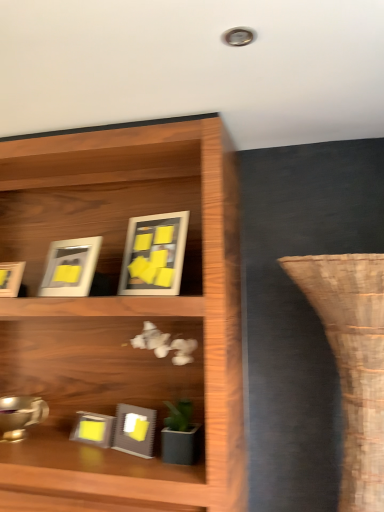
Question: Does matte gray picture frame at center, which appears as the 4th picture frame when viewed from the top, come in front of matte white picture frame at upper left, which ranks as the second picture frame in top-to-bottom order?

Choices:
 (A) yes
 (B) no

Answer: (A)

Question: From the image's perspective, is matte gray picture frame at center, arranged as the second picture frame when ordered from the bottom, located beneath matte white picture frame at upper left, positioned as the 4th picture frame in bottom-to-top order?

Choices:
 (A) no
 (B) yes

Answer: (B)

Question: Is matte gray picture frame at center, which appears as the 4th picture frame when viewed from the top, oriented towards matte white picture frame at upper left, positioned as the 4th picture frame in bottom-to-top order?

Choices:
 (A) no
 (B) yes

Answer: (A)

Question: Is matte gray picture frame at center, arranged as the second picture frame when ordered from the bottom, at the left side of matte white picture frame at upper left, positioned as the 4th picture frame in bottom-to-top order?

Choices:
 (A) yes
 (B) no

Answer: (B)

Question: Is matte gray picture frame at center, which appears as the 4th picture frame when viewed from the top, shorter than matte white picture frame at upper left, positioned as the 4th picture frame in bottom-to-top order?

Choices:
 (A) yes
 (B) no

Answer: (A)

Question: Based on their positions, is brown woven vase at right located to the left or right of matte white picture frame at upper left, positioned as the 4th picture frame in bottom-to-top order?

Choices:
 (A) left
 (B) right

Answer: (B)

Question: From a real-world perspective, is brown woven vase at right above or below matte white picture frame at upper left, positioned as the 4th picture frame in bottom-to-top order?

Choices:
 (A) above
 (B) below

Answer: (B)

Question: In terms of height, does brown woven vase at right look taller or shorter compared to matte white picture frame at upper left, positioned as the 4th picture frame in bottom-to-top order?

Choices:
 (A) tall
 (B) short

Answer: (A)

Question: Based on their sizes in the image, would you say brown woven vase at right is bigger or smaller than matte white picture frame at upper left, which ranks as the second picture frame in top-to-bottom order?

Choices:
 (A) small
 (B) big

Answer: (B)

Question: Is matte white picture frame at left, which ranks as the third picture frame in bottom-to-top order, spatially inside matte white picture frame at upper left, which ranks as the second picture frame in top-to-bottom order, or outside of it?

Choices:
 (A) outside
 (B) inside

Answer: (A)

Question: From a real-world perspective, is matte white picture frame at left, which ranks as the third picture frame in bottom-to-top order, above or below matte white picture frame at upper left, positioned as the 4th picture frame in bottom-to-top order?

Choices:
 (A) below
 (B) above

Answer: (A)

Question: Considering the relative positions of matte white picture frame at left, which ranks as the third picture frame in bottom-to-top order, and matte white picture frame at upper left, which ranks as the second picture frame in top-to-bottom order, in the image provided, is matte white picture frame at left, which ranks as the third picture frame in bottom-to-top order, to the left or to the right of matte white picture frame at upper left, which ranks as the second picture frame in top-to-bottom order,?

Choices:
 (A) right
 (B) left

Answer: (B)

Question: Considering the positions of matte white picture frame at left, which ranks as the third picture frame in bottom-to-top order, and matte white picture frame at upper left, positioned as the 4th picture frame in bottom-to-top order, in the image, is matte white picture frame at left, which ranks as the third picture frame in bottom-to-top order, taller or shorter than matte white picture frame at upper left, positioned as the 4th picture frame in bottom-to-top order,?

Choices:
 (A) short
 (B) tall

Answer: (A)

Question: Does point (114, 437) appear closer or farther from the camera than point (79, 286)?

Choices:
 (A) farther
 (B) closer

Answer: (A)

Question: From the image's perspective, is matte gray picture frame at center, arranged as the second picture frame when ordered from the bottom, positioned above or below matte white picture frame at upper left, which ranks as the second picture frame in top-to-bottom order?

Choices:
 (A) above
 (B) below

Answer: (B)